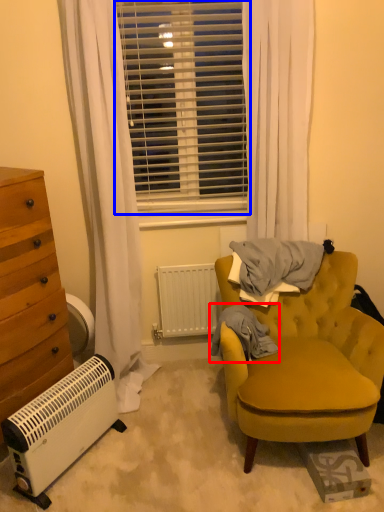
Question: Which object is closer to the camera taking this photo, blanket (highlighted by a red box) or window blind (highlighted by a blue box)?

Choices:
 (A) blanket
 (B) window blind

Answer: (A)